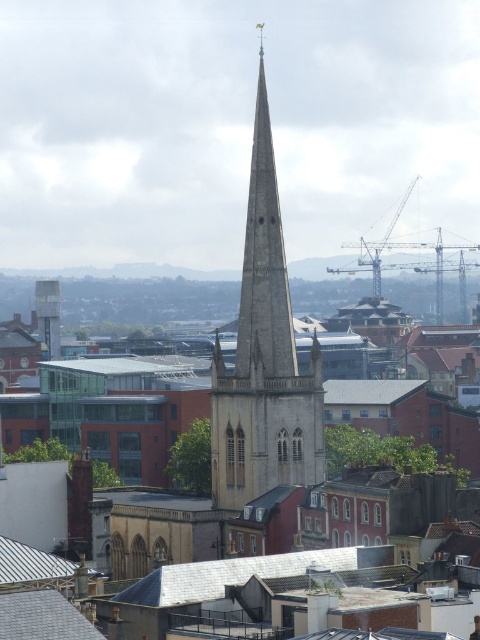
Between smooth stone spire at center and metallic gray tower at center, which one appears on the right side from the viewer's perspective?

From the viewer's perspective, smooth stone spire at center appears more on the right side.

Find the location of a particular element. This screenshot has height=640, width=480. smooth stone spire at center is located at coordinates (264, 356).

Does point (273, 419) lie in front of point (50, 289)?

Yes.

Image resolution: width=480 pixels, height=640 pixels. I want to click on smooth stone spire at center, so (264, 356).

Is smooth stone spire at center taller than gray slate roof at lower left?

Correct, smooth stone spire at center is much taller as gray slate roof at lower left.

Can you confirm if smooth stone spire at center is bigger than gray slate roof at lower left?

Indeed, smooth stone spire at center has a larger size compared to gray slate roof at lower left.

Consider the image. Who is more distant from viewer, (315, 417) or (31, 637)?

Point (315, 417)

Where is `smooth stone spire at center`? smooth stone spire at center is located at coordinates (264, 356).

Between smooth stone spire at center and gray slate roof at center, which one appears on the right side from the viewer's perspective?

gray slate roof at center is more to the right.

Is point (260, 324) behind point (267, 561)?

That is True.

In the scene shown: Who is more distant from viewer, (321, 387) or (192, 577)?

Point (321, 387)

This screenshot has height=640, width=480. In order to click on smooth stone spire at center in this screenshot , I will do `click(264, 356)`.